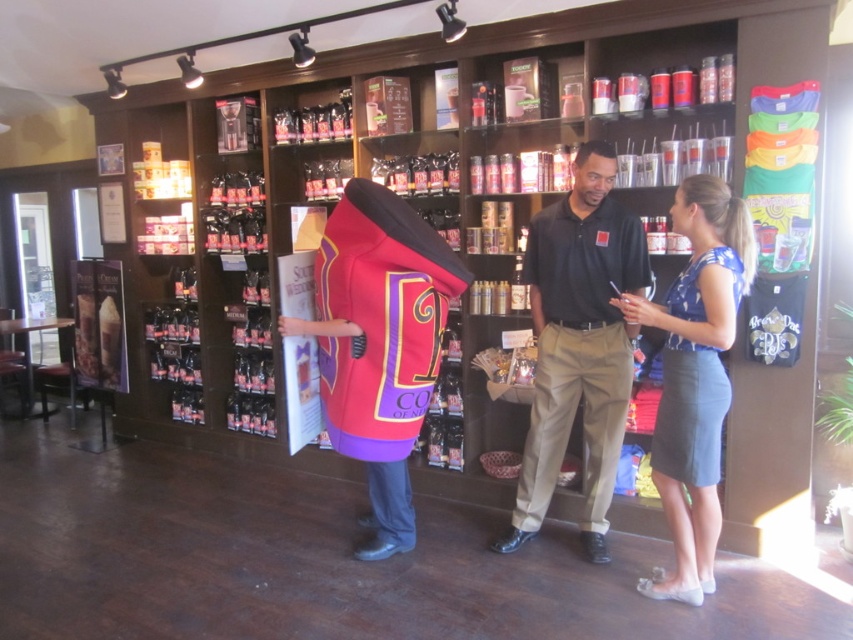
Is black cotton polo shirt at center further to the viewer compared to blue satin blouse at center?

Yes, it is.

From the picture: Who is more distant from viewer, (578, 401) or (674, 353)?

Positioned behind is point (578, 401).

Where is `black cotton polo shirt at center`? The image size is (853, 640). black cotton polo shirt at center is located at coordinates (578, 342).